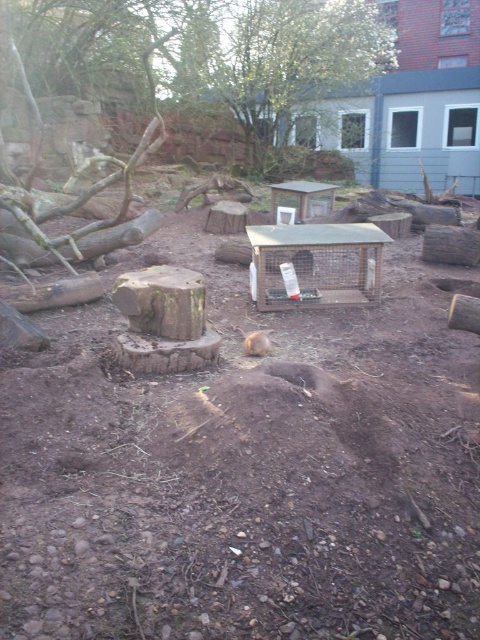
Is brown soil at center bigger than brown furry animal at center?

Yes, brown soil at center is bigger than brown furry animal at center.

Is brown soil at center positioned behind brown furry animal at center?

No, it is not.

Which is in front, point (72, 502) or point (262, 352)?

Point (72, 502) is more forward.

Find the location of a particular element. brown soil at center is located at coordinates (247, 474).